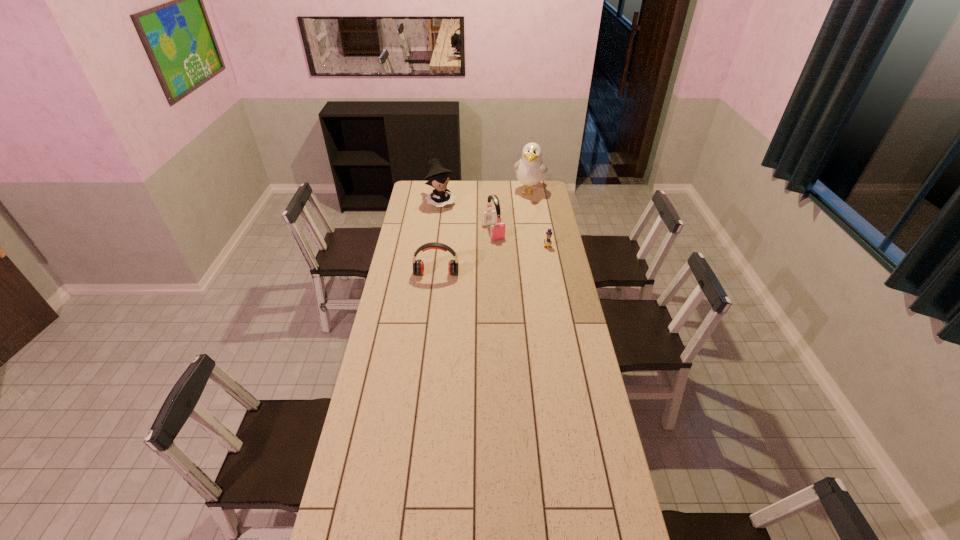
Locate an element on the screen. The image size is (960, 540). vacant space at the far right corner of the desktop is located at coordinates (540, 198).

Locate an element on the screen. The image size is (960, 540). empty location between the farther earphone and the second tallest object is located at coordinates (468, 217).

Find the location of a particular element. The image size is (960, 540). vacant point located between the left earphone and the farther earphone is located at coordinates (465, 253).

Image resolution: width=960 pixels, height=540 pixels. Identify the location of empty space that is in between the second tallest object and the fourth tallest object. (439, 238).

The image size is (960, 540). I want to click on free spot between the fourth shortest object and the left earphone, so coord(439,238).

At what (x,y) coordinates should I click in order to perform the action: click on free space between the duckling and the shorter earphone. Please return your answer as a coordinate pair (x, y). The width and height of the screenshot is (960, 540). Looking at the image, I should click on (492, 260).

You are a GUI agent. You are given a task and a screenshot of the screen. Output one action in this format:
    pyautogui.click(x=<x>, y=<y>)
    Task: Click on the free space between the second tallest object and the nearest object
    
    Given the screenshot: What is the action you would take?
    click(439, 238)

The width and height of the screenshot is (960, 540). Identify the location of empty space between the nearer earphone and the tallest object. (483, 233).

This screenshot has width=960, height=540. I want to click on free space between the doll and the third shortest object, so click(x=468, y=217).

This screenshot has width=960, height=540. What are the coordinates of `vacant region between the doll and the tallest object` in the screenshot? It's located at (485, 197).